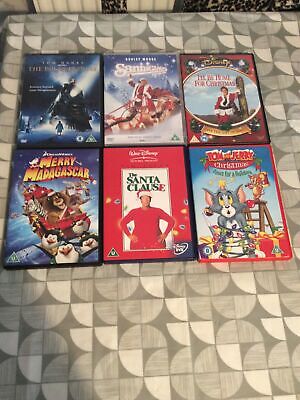
You are a GUI agent. You are given a task and a screenshot of the screen. Output one action in this format:
    pyautogui.click(x=<x>, y=<y>)
    Task: Click on the dvd cases
    The width and height of the screenshot is (300, 400).
    Given the screenshot: What is the action you would take?
    pyautogui.click(x=69, y=232), pyautogui.click(x=72, y=98), pyautogui.click(x=129, y=100), pyautogui.click(x=225, y=107), pyautogui.click(x=232, y=210), pyautogui.click(x=147, y=229)